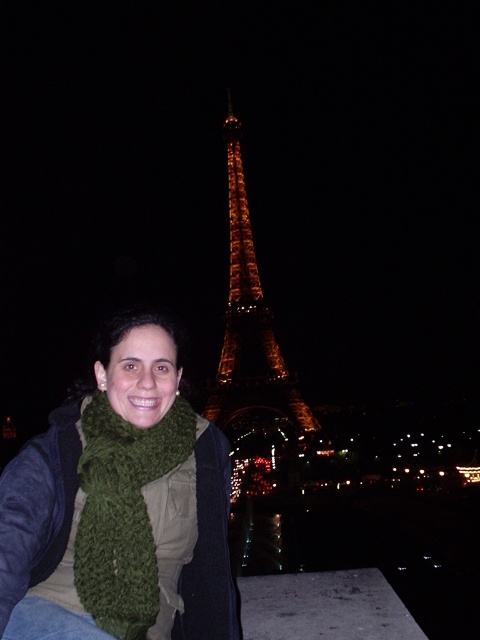
Between green knitted scarf at center and illuminated glass eiffel tower at center, which one appears on the right side from the viewer's perspective?

From the viewer's perspective, illuminated glass eiffel tower at center appears more on the right side.

From the picture: Measure the distance between green knitted scarf at center and camera.

A distance of 143.31 meters exists between green knitted scarf at center and camera.

Identify the location of green knitted scarf at center. This screenshot has width=480, height=640. (120, 506).

Is green knitted scarf at lower left smaller than illuminated glass eiffel tower at center?

Yes, green knitted scarf at lower left is smaller than illuminated glass eiffel tower at center.

Can you confirm if green knitted scarf at lower left is thinner than illuminated glass eiffel tower at center?

No, green knitted scarf at lower left is not thinner than illuminated glass eiffel tower at center.

Is point (99, 602) positioned before point (249, 381)?

Yes, it is.

You are a GUI agent. You are given a task and a screenshot of the screen. Output one action in this format:
    pyautogui.click(x=<x>, y=<y>)
    Task: Click on the green knitted scarf at lower left
    
    Given the screenshot: What is the action you would take?
    pyautogui.click(x=122, y=513)

Can you confirm if green knitted scarf at center is positioned to the left of green knitted scarf at lower left?

No, green knitted scarf at center is not to the left of green knitted scarf at lower left.

Does green knitted scarf at center appear under green knitted scarf at lower left?

Incorrect, green knitted scarf at center is not positioned below green knitted scarf at lower left.

Where is `green knitted scarf at center`? This screenshot has width=480, height=640. green knitted scarf at center is located at coordinates (120, 506).